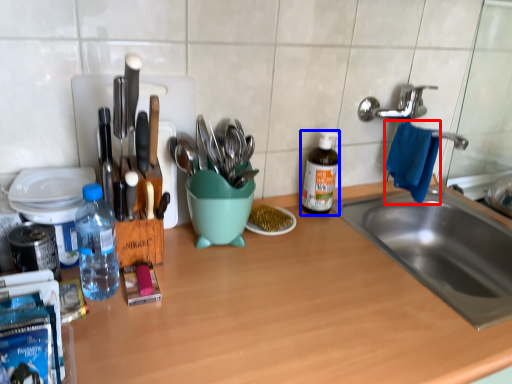
Question: Which object is closer to the camera taking this photo, hand towel (highlighted by a red box) or bottle (highlighted by a blue box)?

Choices:
 (A) hand towel
 (B) bottle

Answer: (A)